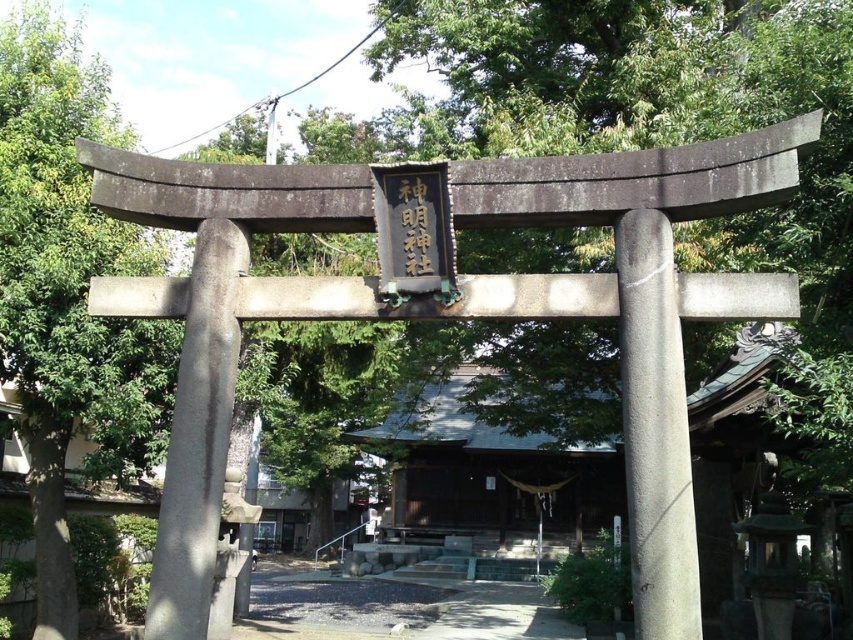
You are a visitor at the Shinto shrine and want to place a small offering between the gray stone pillar at center and the black wood sign at center. Which object should you place it closer to if you want it to be more visible?

The gray stone pillar at center is wider than the black wood sign at center, so placing the offering closer to the black wood sign at center would make it more visible as there is more space around it.